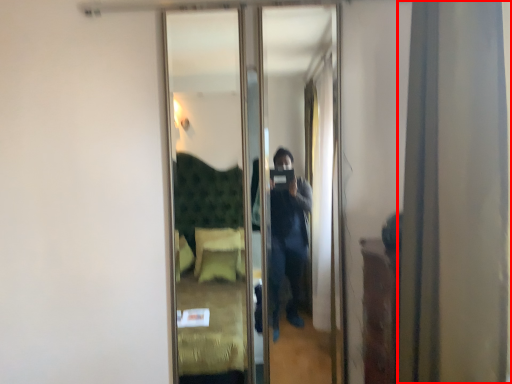
Question: From the image's perspective, where is curtain (annotated by the red box) located relative to mirror?

Choices:
 (A) below
 (B) above

Answer: (B)